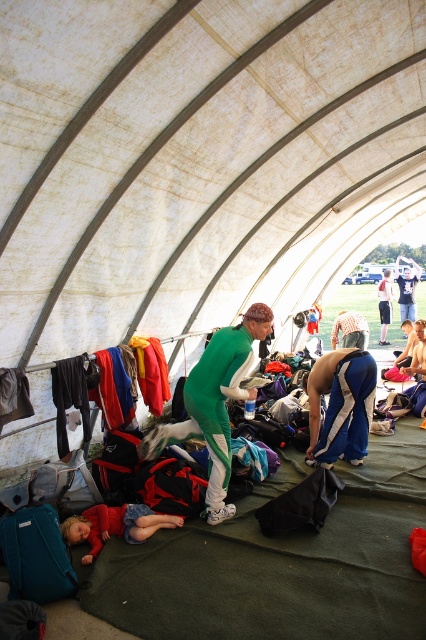
You are setting up a photo shoot inside the tent and want to place the matte red dress at lower left and the blue denim shorts at center in a way that the dress is visible in the shot. Given their current positions, is the dress currently hidden from view by the shorts?

The matte red dress at lower left is positioned under the blue denim shorts at center, so yes, the dress is currently hidden from view by the shorts.

You are standing inside the tent and notice two items at the center. The green fabric person at center and the blue denim shorts at center. Which one is lower in position?

The green fabric person at center is below the blue denim shorts at center, so the green fabric person at center is lower.

You are standing inside the tent and want to pick up the matte red dress at lower left and the blue denim shorts at center. Which item should you reach for first if you want to grab the one closer to you?

The matte red dress at lower left is closer to the viewer than the blue denim shorts at center, so you should reach for the matte red dress at lower left first.